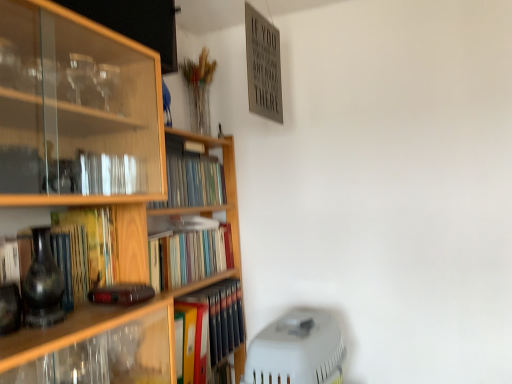
Question: Is hardcover books at center, acting as the 4th book starting from the bottom, at the right side of hardcover book at center-left, the third book ordered from the bottom?

Choices:
 (A) yes
 (B) no

Answer: (A)

Question: Is hardcover books at center, acting as the 4th book starting from the bottom, taller than hardcover book at center-left, acting as the second book starting from the top?

Choices:
 (A) no
 (B) yes

Answer: (A)

Question: Is hardcover books at center, which is the first book in top-to-bottom order, placed right next to hardcover book at center-left, the third book ordered from the bottom?

Choices:
 (A) yes
 (B) no

Answer: (B)

Question: Is hardcover books at center, acting as the 4th book starting from the bottom, positioned with its back to hardcover book at center-left, acting as the second book starting from the top?

Choices:
 (A) yes
 (B) no

Answer: (B)

Question: From a real-world perspective, does hardcover books at center, which is the first book in top-to-bottom order, stand above hardcover book at center-left, acting as the second book starting from the top?

Choices:
 (A) no
 (B) yes

Answer: (B)

Question: Is hardcover books at center, which is the first book in top-to-bottom order, not within hardcover book at center-left, acting as the second book starting from the top?

Choices:
 (A) no
 (B) yes

Answer: (B)

Question: Is multicolored hardcover books at center, acting as the 4th book starting from the top, wider than matte black vase at left?

Choices:
 (A) no
 (B) yes

Answer: (B)

Question: From a real-world perspective, is multicolored hardcover books at center, which is the first book in bottom-to-top order, positioned under matte black vase at left based on gravity?

Choices:
 (A) no
 (B) yes

Answer: (B)

Question: Does multicolored hardcover books at center, which is the first book in bottom-to-top order, appear on the left side of matte black vase at left?

Choices:
 (A) no
 (B) yes

Answer: (A)

Question: Is multicolored hardcover books at center, which is the first book in bottom-to-top order, next to matte black vase at left?

Choices:
 (A) no
 (B) yes

Answer: (A)

Question: Is multicolored hardcover books at center, which is the first book in bottom-to-top order, not near matte black vase at left?

Choices:
 (A) no
 (B) yes

Answer: (A)

Question: Is multicolored hardcover books at center, which is the first book in bottom-to-top order, in front of matte black vase at left?

Choices:
 (A) no
 (B) yes

Answer: (A)

Question: Is multicolored hardcover books at center, which is the first book in bottom-to-top order, placed right next to wooden bookshelf at left?

Choices:
 (A) no
 (B) yes

Answer: (A)